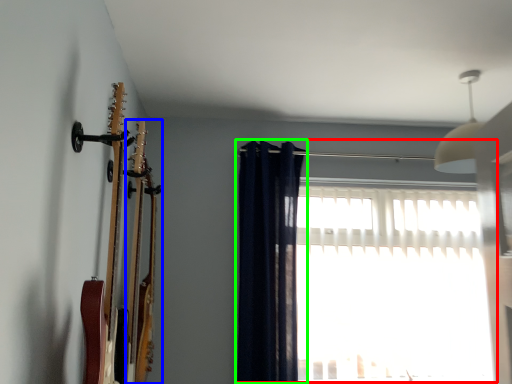
Question: Estimate the real-world distances between objects in this image. Which object is closer to window (highlighted by a red box), guitar (highlighted by a blue box) or curtain (highlighted by a green box)?

Choices:
 (A) guitar
 (B) curtain

Answer: (B)